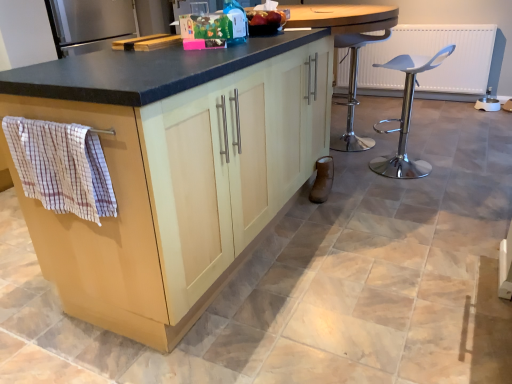
This screenshot has height=384, width=512. What are the coordinates of `unoccupied area behind white plastic stool at right` in the screenshot? It's located at (384, 148).